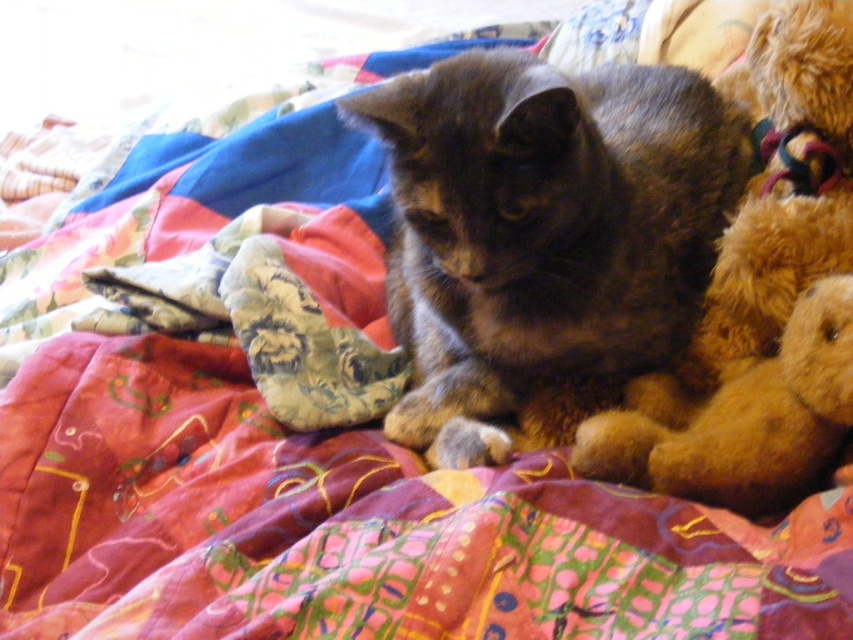
You are a cat owner who wants to place a fuzzy brown teddy bear at right next to the dark brown fur cat at center. Based on their sizes, will the teddy bear fit comfortably without overcrowding the space?

The dark brown fur cat at center might be wider than the fuzzy brown teddy bear at right, so there might not be enough space for the teddy bear to fit comfortably without overcrowding the area.